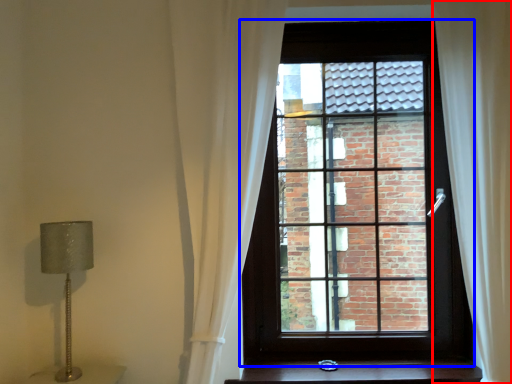
Question: Among these objects, which one is farthest to the camera, curtain (highlighted by a red box) or window (highlighted by a blue box)?

Choices:
 (A) curtain
 (B) window

Answer: (B)